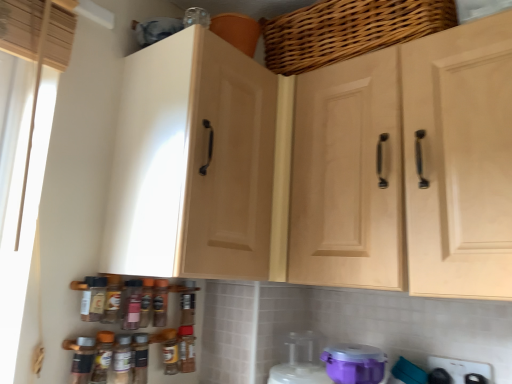
In order to face purple plastic container at lower center, which is counted as the second appliance, starting from the right, should I rotate leftwards or rightwards?

You should look right and rotate roughly 12.817 degrees.

Measure the distance between point (362,361) and camera.

Point (362,361) and camera are 37.76 inches apart.

Locate an element on the screen. light wood cabinet doors at center, positioned as the 1th cabinetry in right-to-left order is located at coordinates (407, 167).

In order to face purple plastic container at lower center, the 4th appliance from the right, should I rotate leftwards or rightwards?

It's best to rotate right around 5.904 degrees.

What is the approximate width of purple plastic container at lower center, positioned as the 1th appliance in left-to-right order?

purple plastic container at lower center, positioned as the 1th appliance in left-to-right order, is 5.95 inches in width.

Describe the element at coordinates (301, 361) in the screenshot. I see `purple plastic container at lower center, the second appliance positioned from the left` at that location.

The height and width of the screenshot is (384, 512). What are the coordinates of `white glossy stove at lower right, which appears as the 4th appliance when viewed from the left` in the screenshot? It's located at (461, 368).

Where is `woven wood basket at upper center`? This screenshot has height=384, width=512. woven wood basket at upper center is located at coordinates (348, 30).

Considering the relative sizes of light wood cabinet doors at center, positioned as the 1th cabinetry in right-to-left order, and purple plastic container at lower center, which is counted as the second appliance, starting from the right, in the image provided, is light wood cabinet doors at center, positioned as the 1th cabinetry in right-to-left order, smaller than purple plastic container at lower center, which is counted as the second appliance, starting from the right,?

No, light wood cabinet doors at center, positioned as the 1th cabinetry in right-to-left order, is not smaller than purple plastic container at lower center, which is counted as the second appliance, starting from the right.

Starting from the light wood cabinet doors at center, positioned as the 1th cabinetry in right-to-left order, which appliance is the 1st one to the left? Please provide its 2D coordinates.

[(354, 363)]

Can you tell me how much light wood cabinet doors at center, which is counted as the 2th cabinetry, starting from the left, and purple plastic container at lower center, which is counted as the second appliance, starting from the right, differ in facing direction?

19.3 degrees.

In terms of width, does light wood cabinet doors at center, which is counted as the 2th cabinetry, starting from the left, look wider or thinner when compared to purple plastic container at lower center, which is counted as the second appliance, starting from the right?

Considering their sizes, light wood cabinet doors at center, which is counted as the 2th cabinetry, starting from the left, looks broader than purple plastic container at lower center, which is counted as the second appliance, starting from the right.

Considering the sizes of objects matte wood cabinet at left, marked as the first cabinetry in a left-to-right arrangement, and woven wood basket at upper center in the image provided, who is bigger, matte wood cabinet at left, marked as the first cabinetry in a left-to-right arrangement, or woven wood basket at upper center?

matte wood cabinet at left, marked as the first cabinetry in a left-to-right arrangement, is bigger.

Who is more distant, matte wood cabinet at left, marked as the first cabinetry in a left-to-right arrangement, or woven wood basket at upper center?

woven wood basket at upper center is further away from the camera.

From the image's perspective, is matte wood cabinet at left, the 2th cabinetry positioned from the right, located above or below woven wood basket at upper center?

From the image's perspective, matte wood cabinet at left, the 2th cabinetry positioned from the right, appears below woven wood basket at upper center.

How distant is matte wood cabinet at left, the 2th cabinetry positioned from the right, from woven wood basket at upper center?

matte wood cabinet at left, the 2th cabinetry positioned from the right, and woven wood basket at upper center are 14.66 inches apart from each other.

Is white glossy stove at lower right, the first appliance viewed from the right, located within purple plastic container at lower center, the 4th appliance from the right?

That's incorrect, white glossy stove at lower right, the first appliance viewed from the right, is not inside purple plastic container at lower center, the 4th appliance from the right.

Does purple plastic container at lower center, positioned as the 1th appliance in left-to-right order, have a greater height compared to white glossy stove at lower right, which appears as the 4th appliance when viewed from the left?

Yes.

Between purple plastic container at lower center, the 4th appliance from the right, and white glossy stove at lower right, which appears as the 4th appliance when viewed from the left, which one appears on the right side from the viewer's perspective?

white glossy stove at lower right, which appears as the 4th appliance when viewed from the left, is more to the right.

From the image's perspective, between purple plastic container at lower center, the 4th appliance from the right, and white glossy stove at lower right, which appears as the 4th appliance when viewed from the left, which one is located above?

white glossy stove at lower right, which appears as the 4th appliance when viewed from the left, is shown above in the image.

Which object is thinner, woven wood basket at upper center or purple plastic container at lower center, positioned as the 1th appliance in left-to-right order?

purple plastic container at lower center, positioned as the 1th appliance in left-to-right order.

Can you confirm if woven wood basket at upper center is shorter than purple plastic container at lower center, positioned as the 1th appliance in left-to-right order?

Incorrect, the height of woven wood basket at upper center does not fall short of that of purple plastic container at lower center, positioned as the 1th appliance in left-to-right order.

Can you tell me how much woven wood basket at upper center and purple plastic container at lower center, the 4th appliance from the right, differ in facing direction?

The angular difference between woven wood basket at upper center and purple plastic container at lower center, the 4th appliance from the right, is 9.75 degrees.

From a real-world perspective, is woven wood basket at upper center physically above purple plastic container at lower center, the 4th appliance from the right?

Correct, in the physical world, woven wood basket at upper center is higher than purple plastic container at lower center, the 4th appliance from the right.

Considering the relative sizes of light wood cabinet doors at center, positioned as the 1th cabinetry in right-to-left order, and white glossy stove at lower right, the first appliance viewed from the right, in the image provided, is light wood cabinet doors at center, positioned as the 1th cabinetry in right-to-left order, smaller than white glossy stove at lower right, the first appliance viewed from the right,?

Incorrect, light wood cabinet doors at center, positioned as the 1th cabinetry in right-to-left order, is not smaller in size than white glossy stove at lower right, the first appliance viewed from the right.

From a real-world perspective, is light wood cabinet doors at center, which is counted as the 2th cabinetry, starting from the left, physically below white glossy stove at lower right, which appears as the 4th appliance when viewed from the left?

No, from a real-world perspective, light wood cabinet doors at center, which is counted as the 2th cabinetry, starting from the left, is not beneath white glossy stove at lower right, which appears as the 4th appliance when viewed from the left.

Is the position of light wood cabinet doors at center, positioned as the 1th cabinetry in right-to-left order, less distant than that of white glossy stove at lower right, the first appliance viewed from the right?

Yes.

Which object is thinner, purple plastic container at lower center, the 4th appliance from the right, or matte wood cabinet at left, marked as the first cabinetry in a left-to-right arrangement?

With smaller width is purple plastic container at lower center, the 4th appliance from the right.

Based on the photo, is purple plastic container at lower center, positioned as the 1th appliance in left-to-right order, not within matte wood cabinet at left, marked as the first cabinetry in a left-to-right arrangement?

Absolutely, purple plastic container at lower center, positioned as the 1th appliance in left-to-right order, is external to matte wood cabinet at left, marked as the first cabinetry in a left-to-right arrangement.

Does purple plastic container at lower center, positioned as the 1th appliance in left-to-right order, appear on the left side of matte wood cabinet at left, marked as the first cabinetry in a left-to-right arrangement?

In fact, purple plastic container at lower center, positioned as the 1th appliance in left-to-right order, is to the right of matte wood cabinet at left, marked as the first cabinetry in a left-to-right arrangement.

From the picture: How many degrees apart are the facing directions of purple plastic container at lower center, the 4th appliance from the right, and matte wood cabinet at left, marked as the first cabinetry in a left-to-right arrangement?

They differ by 86.1 degrees in their facing directions.

Does purple plastic container at lower center, the 4th appliance from the right, have a smaller size compared to purple plastic container at lower center, which is counted as the second appliance, starting from the right?

Actually, purple plastic container at lower center, the 4th appliance from the right, might be larger than purple plastic container at lower center, which is counted as the second appliance, starting from the right.

Is the position of purple plastic container at lower center, positioned as the 1th appliance in left-to-right order, less distant than that of purple plastic container at lower center, which is counted as the second appliance, starting from the right?

No.

Is point (279, 374) more distant than point (368, 363)?

Yes, it is.

Between purple plastic container at lower center, positioned as the 1th appliance in left-to-right order, and purple plastic container at lower center, the third appliance from the left, which one appears on the right side from the viewer's perspective?

purple plastic container at lower center, the third appliance from the left, is more to the right.

From a real-world perspective, which cabinetry is the 1st one above the purple plastic container at lower center, which is counted as the second appliance, starting from the right? Please provide its 2D coordinates.

[(407, 167)]

The image size is (512, 384). Find the location of `basket above the matte wood cabinet at left, marked as the first cabinetry in a left-to-right arrangement (from the image's perspective)`. basket above the matte wood cabinet at left, marked as the first cabinetry in a left-to-right arrangement (from the image's perspective) is located at coordinates (348, 30).

Considering their positions, is white glossy stove at lower right, which appears as the 4th appliance when viewed from the left, positioned further to light wood cabinet doors at center, which is counted as the 2th cabinetry, starting from the left, than woven wood basket at upper center?

white glossy stove at lower right, which appears as the 4th appliance when viewed from the left.

Which object lies further to the anchor point white glossy stove at lower right, which appears as the 4th appliance when viewed from the left, purple plastic container at lower center, which is counted as the second appliance, starting from the right, or matte wood cabinet at left, marked as the first cabinetry in a left-to-right arrangement?

Among the two, matte wood cabinet at left, marked as the first cabinetry in a left-to-right arrangement, is located further to white glossy stove at lower right, which appears as the 4th appliance when viewed from the left.

Estimate the real-world distances between objects in this image. Which object is further from white glossy stove at lower right, the first appliance viewed from the right, woven wood basket at upper center or matte wood cabinet at left, marked as the first cabinetry in a left-to-right arrangement?

Based on the image, woven wood basket at upper center appears to be further to white glossy stove at lower right, the first appliance viewed from the right.

Estimate the real-world distances between objects in this image. Which object is closer to purple plastic container at lower center, the third appliance from the left, woven wood basket at upper center or purple plastic container at lower center, the 4th appliance from the right?

purple plastic container at lower center, the 4th appliance from the right, is positioned closer to the anchor purple plastic container at lower center, the third appliance from the left.

When comparing their distances from woven wood basket at upper center, does white glossy stove at lower right, the first appliance viewed from the right, or purple plastic container at lower center, the third appliance from the left, seem further?

The object further to woven wood basket at upper center is white glossy stove at lower right, the first appliance viewed from the right.

Looking at the image, which one is located closer to light wood cabinet doors at center, which is counted as the 2th cabinetry, starting from the left, purple plastic container at lower center, which is counted as the 3th appliance, starting from the right, or woven wood basket at upper center?

Among the two, woven wood basket at upper center is located nearer to light wood cabinet doors at center, which is counted as the 2th cabinetry, starting from the left.

Based on their spatial positions, is purple plastic container at lower center, which is counted as the second appliance, starting from the right, or purple plastic container at lower center, which is counted as the 3th appliance, starting from the right, further from purple plastic container at lower center, positioned as the 1th appliance in left-to-right order?

purple plastic container at lower center, which is counted as the second appliance, starting from the right, is positioned further to the anchor purple plastic container at lower center, positioned as the 1th appliance in left-to-right order.

From the image, which object appears to be farther from light wood cabinet doors at center, positioned as the 1th cabinetry in right-to-left order, white glossy stove at lower right, the first appliance viewed from the right, or purple plastic container at lower center, the second appliance positioned from the left?

white glossy stove at lower right, the first appliance viewed from the right, is positioned further to the anchor light wood cabinet doors at center, positioned as the 1th cabinetry in right-to-left order.

Identify the location of cabinetry between matte wood cabinet at left, the 2th cabinetry positioned from the right, and white glossy stove at lower right, the first appliance viewed from the right, in the horizontal direction. The height and width of the screenshot is (384, 512). (407, 167).

Find the location of a particular element. This screenshot has width=512, height=384. basket situated between matte wood cabinet at left, the 2th cabinetry positioned from the right, and light wood cabinet doors at center, positioned as the 1th cabinetry in right-to-left order, from left to right is located at coordinates (348, 30).

Identify the location of appliance between woven wood basket at upper center and purple plastic container at lower center, which is counted as the 3th appliance, starting from the right, in the vertical direction. This screenshot has height=384, width=512. (354, 363).

Find the location of a particular element. This screenshot has width=512, height=384. cabinetry between matte wood cabinet at left, marked as the first cabinetry in a left-to-right arrangement, and purple plastic container at lower center, positioned as the 1th appliance in left-to-right order, in the up-down direction is located at coordinates (407, 167).